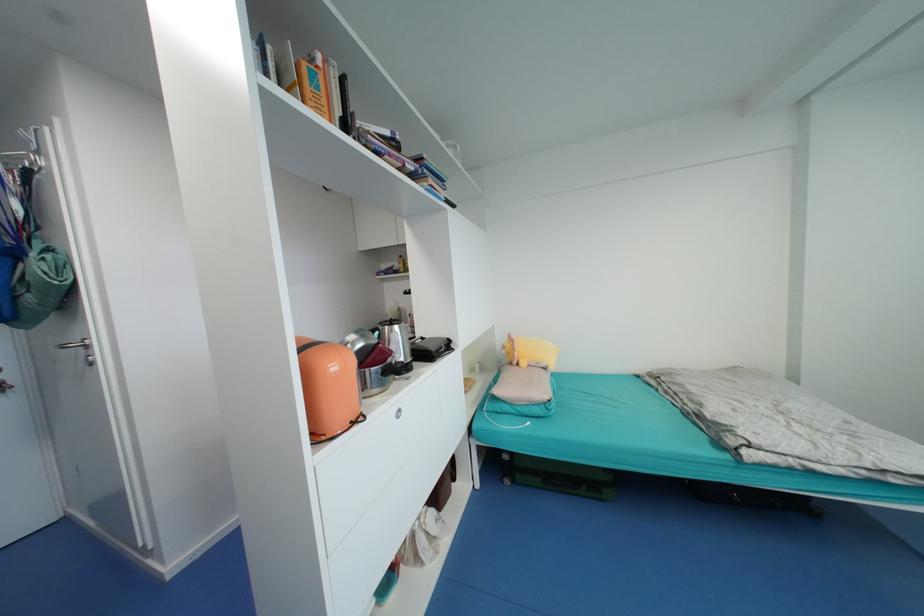
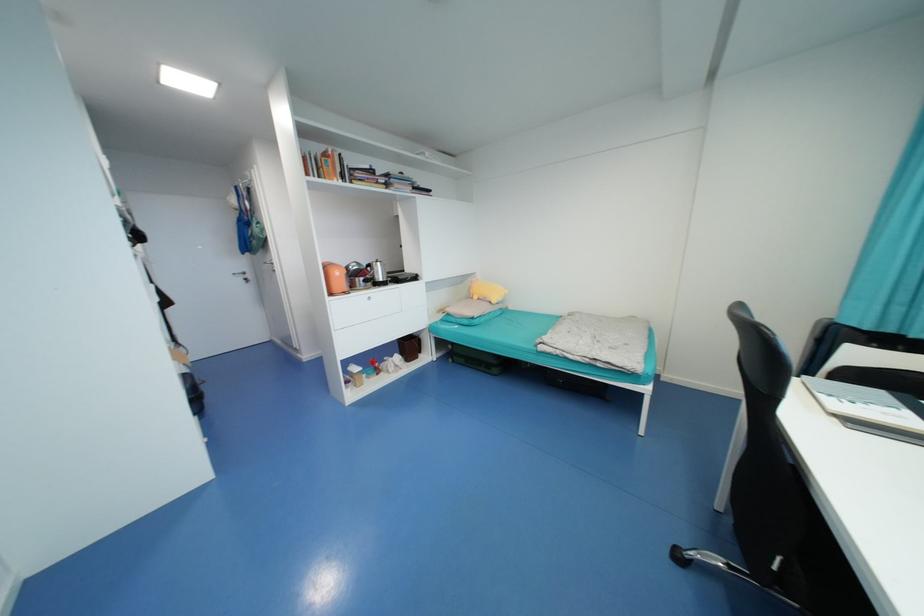
Where in the second image is the point corresponding to point 529,365 from the first image?

(480, 299)